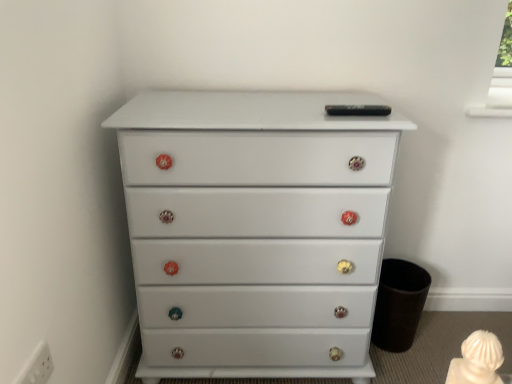
Find the location of `vacant point above white glossy chest of drawers at center (from a real-world perspective)`. vacant point above white glossy chest of drawers at center (from a real-world perspective) is located at coordinates (263, 100).